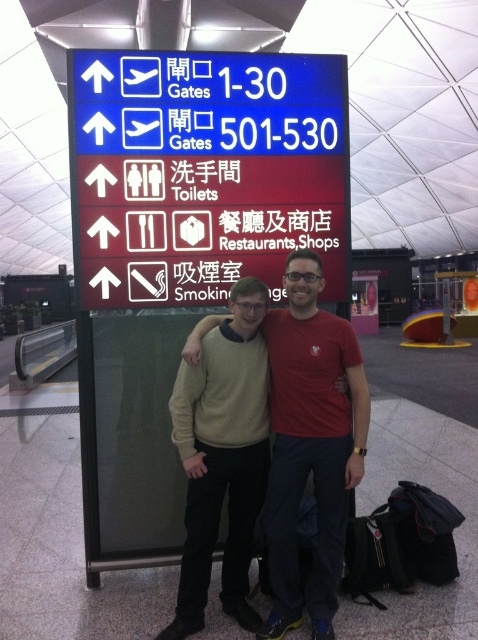
Question: Can you confirm if blue plastic sign at upper center is positioned above red t-shirt at center?

Choices:
 (A) yes
 (B) no

Answer: (A)

Question: Which object appears farthest from the camera in this image?

Choices:
 (A) beige sweater at center
 (B) blue plastic sign at upper center
 (C) red t-shirt at center

Answer: (B)

Question: Considering the real-world distances, which object is farthest from the beige sweater at center?

Choices:
 (A) red t-shirt at center
 (B) blue plastic sign at upper center

Answer: (B)

Question: Can you confirm if red t-shirt at center is smaller than beige sweater at center?

Choices:
 (A) no
 (B) yes

Answer: (A)

Question: Is red t-shirt at center wider than beige sweater at center?

Choices:
 (A) yes
 (B) no

Answer: (A)

Question: Which object appears farthest from the camera in this image?

Choices:
 (A) blue plastic sign at upper center
 (B) red t-shirt at center

Answer: (A)